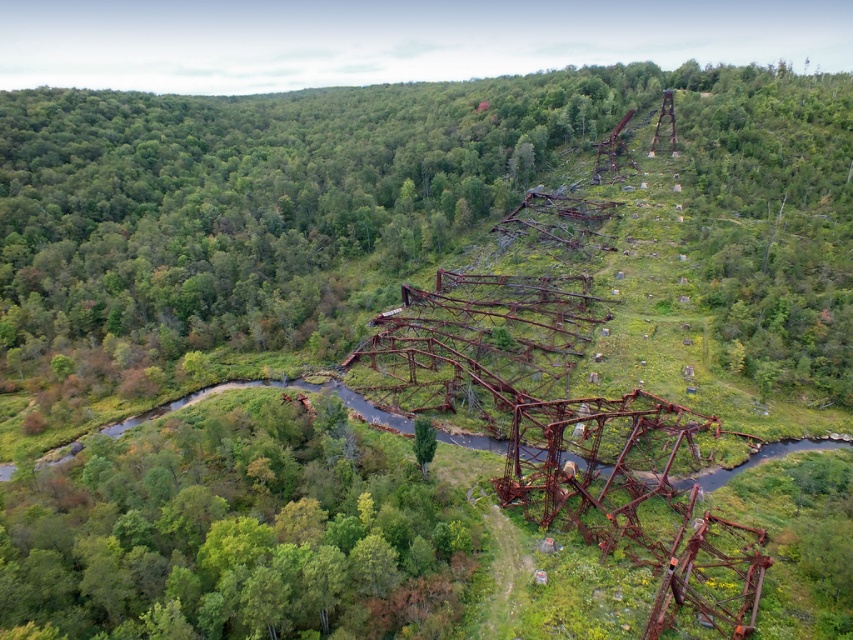
You are a hiker standing at the highest point of the terrain in this forest scene. You notice two trees in the distance, the green matte tree at lower left and the green matte tree at center. Which tree would appear larger in your field of view?

The green matte tree at lower left is much taller than the green matte tree at center. Since it is taller, it would appear larger in your field of view even though it might be farther away.

From the picture: You are a hiker trying to navigate through the dense greenery in the image. You spot two landmarks, the green matte tree at lower left and the green matte tree at center. Which tree should you head towards if you want to find a larger tree to rest under?

The green matte tree at lower left has a larger size compared to the green matte tree at center, so you should head towards the green matte tree at lower left to find a larger tree to rest under.